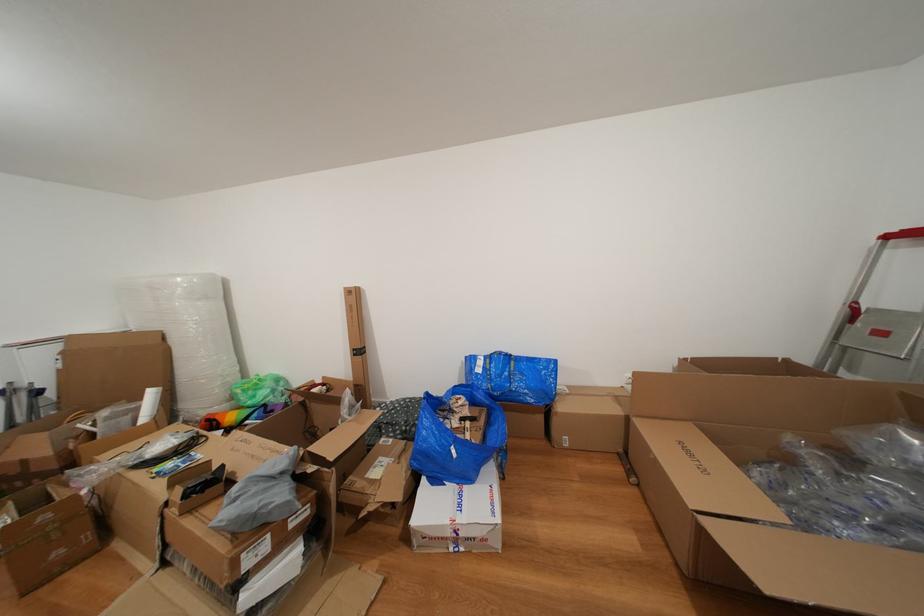
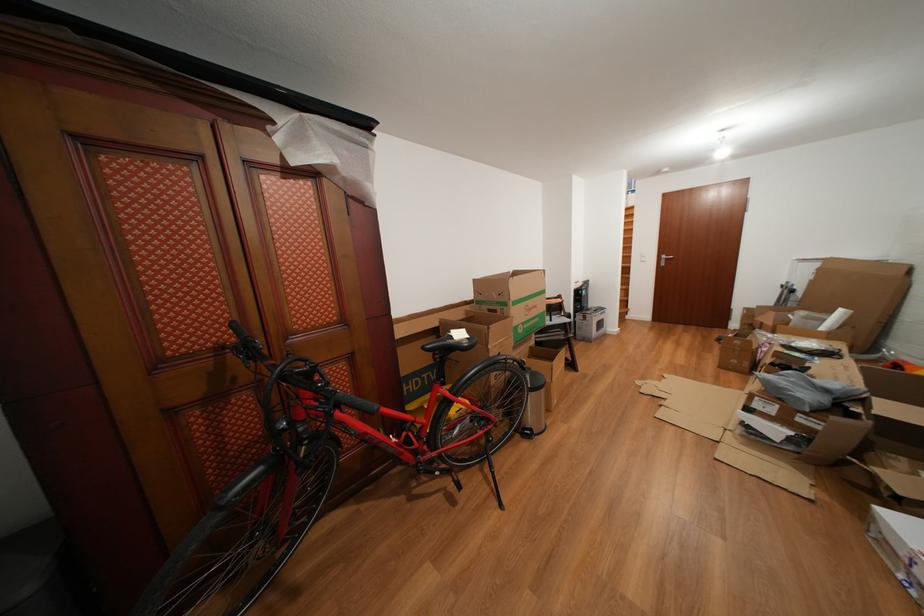
Find the pixel in the second image that matches [71,378] in the first image.

(821, 288)